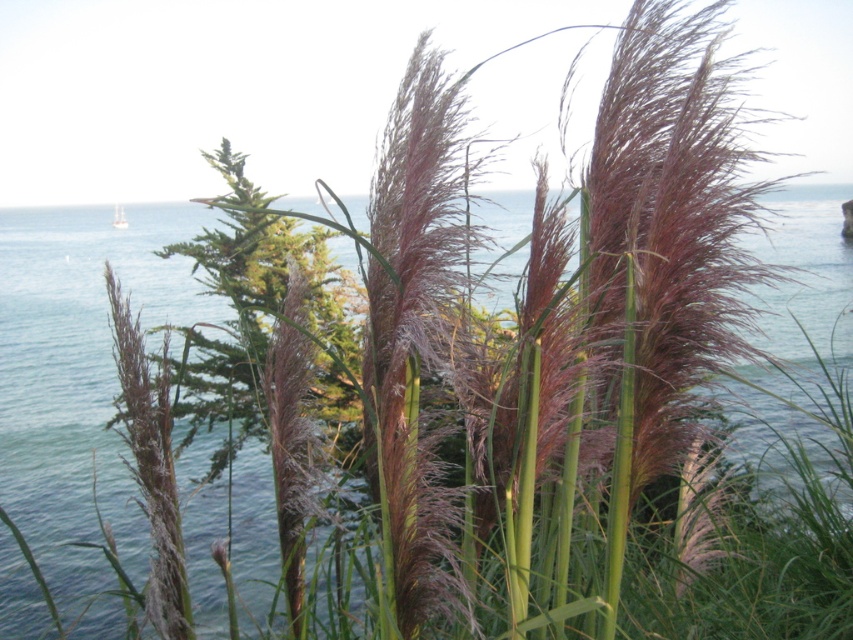
Who is more forward, (175, 276) or (115, 205)?

Point (175, 276) is in front.

At what (x,y) coordinates should I click in order to perform the action: click on blue water at center. Please return your answer as a coordinate pair (x, y). Image resolution: width=853 pixels, height=640 pixels. Looking at the image, I should click on (70, 304).